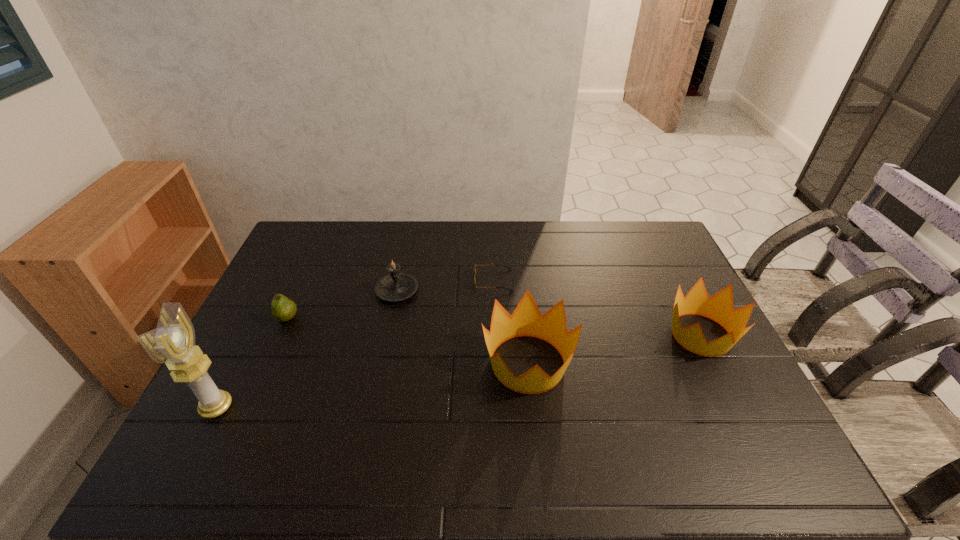
Where is `free point located 0.370m on the left of the fifth shortest object`? This screenshot has height=540, width=960. free point located 0.370m on the left of the fifth shortest object is located at coordinates (348, 363).

This screenshot has width=960, height=540. In order to click on free location located 0.130m on the left of the rightmost object in this screenshot , I will do `click(620, 335)`.

This screenshot has height=540, width=960. I want to click on free space located 0.270m on the right of the candle, so click(x=501, y=291).

The width and height of the screenshot is (960, 540). Identify the location of vacant space situated on the front-facing side of the shortest object. (454, 281).

The height and width of the screenshot is (540, 960). Identify the location of free space located on the front-facing side of the shortest object. coord(430,281).

This screenshot has width=960, height=540. I want to click on vacant position located 0.400m on the front-facing side of the shortest object, so click(x=355, y=281).

The image size is (960, 540). What are the coordinates of `blank area located on the front of the fifth object from right to left` in the screenshot? It's located at (253, 392).

The height and width of the screenshot is (540, 960). I want to click on vacant space situated 0.200m on the front-facing side of the leftmost object, so [x=312, y=407].

Locate an element on the screen. This screenshot has width=960, height=540. crown at the near edge is located at coordinates (526, 320).

At what (x,y) coordinates should I click in order to perform the action: click on award that is at the near edge. Please return your answer as a coordinate pair (x, y). This screenshot has height=540, width=960. Looking at the image, I should click on (172, 343).